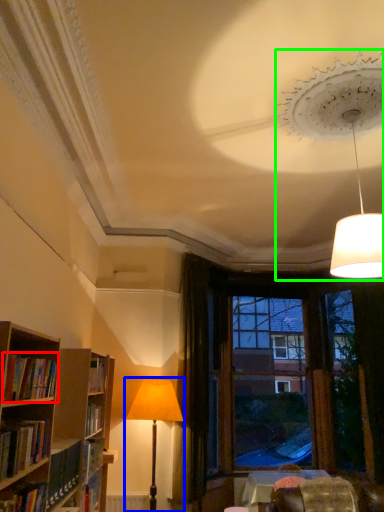
Question: Considering the real-world distances, which object is closest to book (highlighted by a red box)? lamp (highlighted by a blue box) or lamp (highlighted by a green box).

Choices:
 (A) lamp
 (B) lamp

Answer: (A)